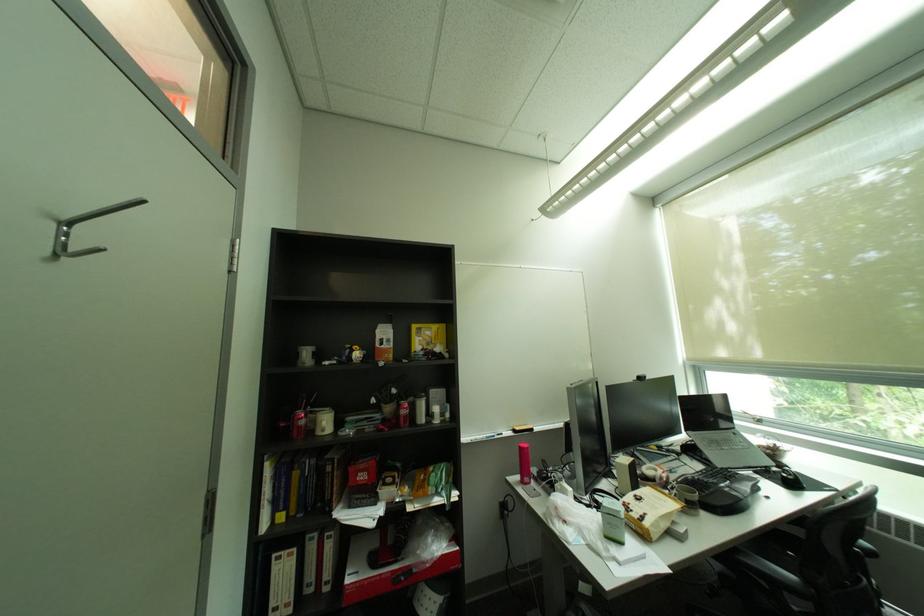
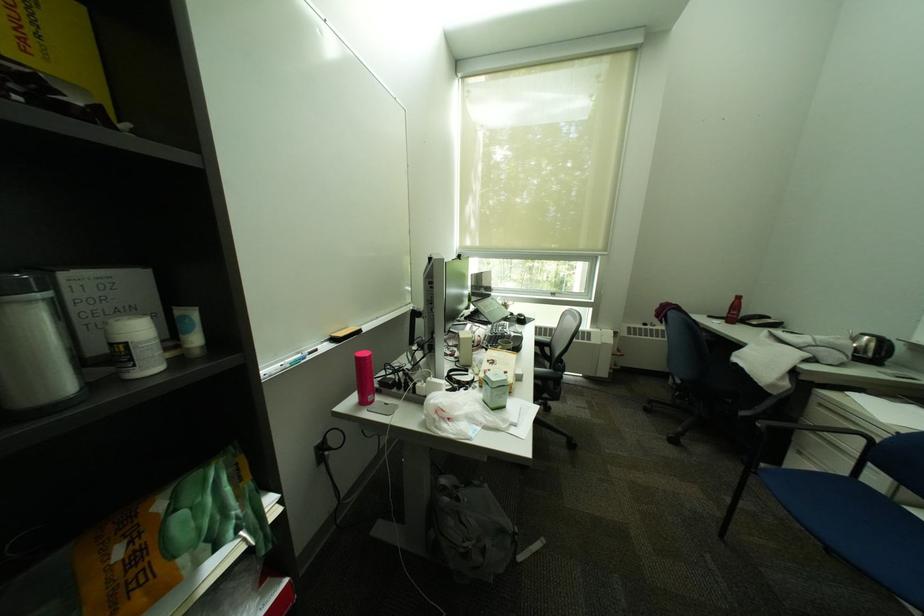
Based on the continuous images, in which direction is the camera rotating?

The camera's rotation is toward right-down.